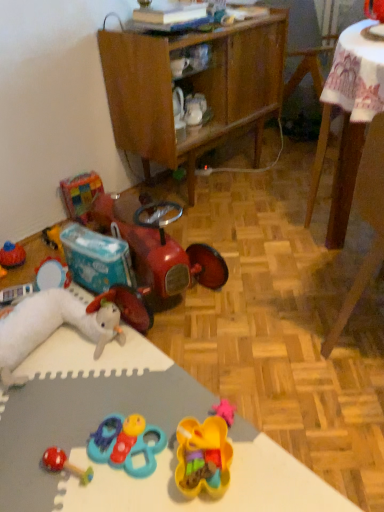
Find the location of a particular element. The image size is (384, 512). free point above plastic toy at center (from a real-world perspective) is located at coordinates (110, 433).